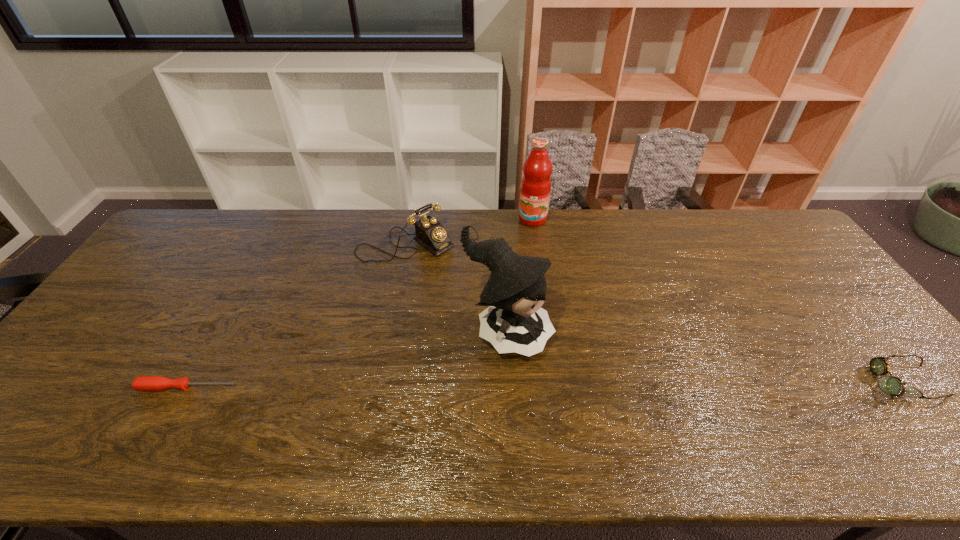
This screenshot has height=540, width=960. In order to click on screwdriver at the near edge in this screenshot , I will do `click(143, 383)`.

You are a GUI agent. You are given a task and a screenshot of the screen. Output one action in this format:
    pyautogui.click(x=<x>, y=<y>)
    Task: Click on the spectacles that is at the near edge
    The image size is (960, 540).
    Given the screenshot: What is the action you would take?
    pyautogui.click(x=892, y=385)

Where is `object located at the right edge`? The height and width of the screenshot is (540, 960). object located at the right edge is located at coordinates (892, 385).

The height and width of the screenshot is (540, 960). Identify the location of object located at the near right corner. (892, 385).

In order to click on vacant area at the far edge in this screenshot , I will do `click(692, 217)`.

You are a GUI agent. You are given a task and a screenshot of the screen. Output one action in this format:
    pyautogui.click(x=<x>, y=<y>)
    Task: Click on the vacant area at the near edge
    This screenshot has height=540, width=960.
    Given the screenshot: What is the action you would take?
    pyautogui.click(x=394, y=414)

The width and height of the screenshot is (960, 540). In order to click on vacant space at the right edge of the desktop in this screenshot , I will do `click(851, 342)`.

In order to click on vacant space at the far left corner in this screenshot , I will do `click(161, 251)`.

Where is `empty space that is in between the fourth object from right to left and the doll`? The height and width of the screenshot is (540, 960). empty space that is in between the fourth object from right to left and the doll is located at coordinates (456, 290).

Locate an element on the screen. Image resolution: width=960 pixels, height=540 pixels. free space between the fourth nearest object and the farthest object is located at coordinates (469, 232).